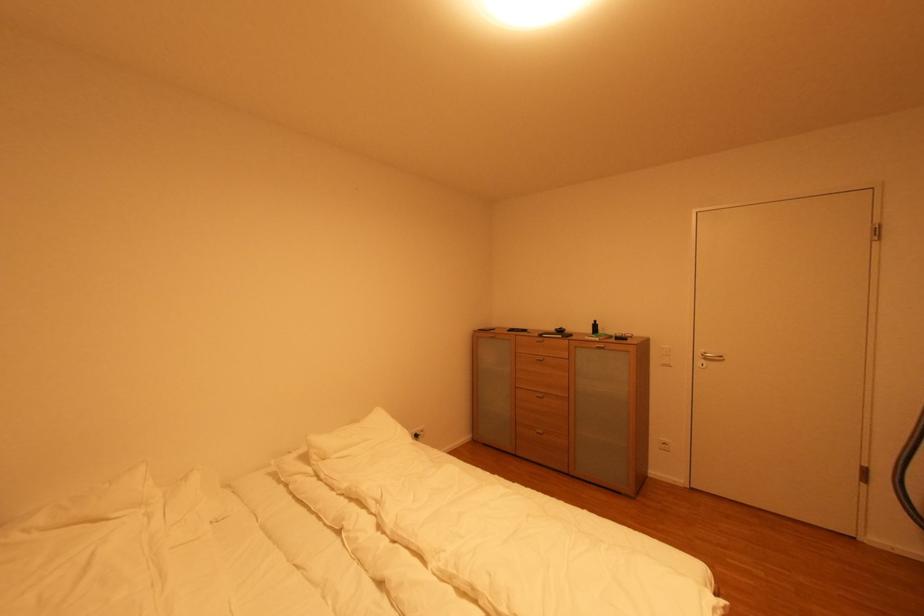
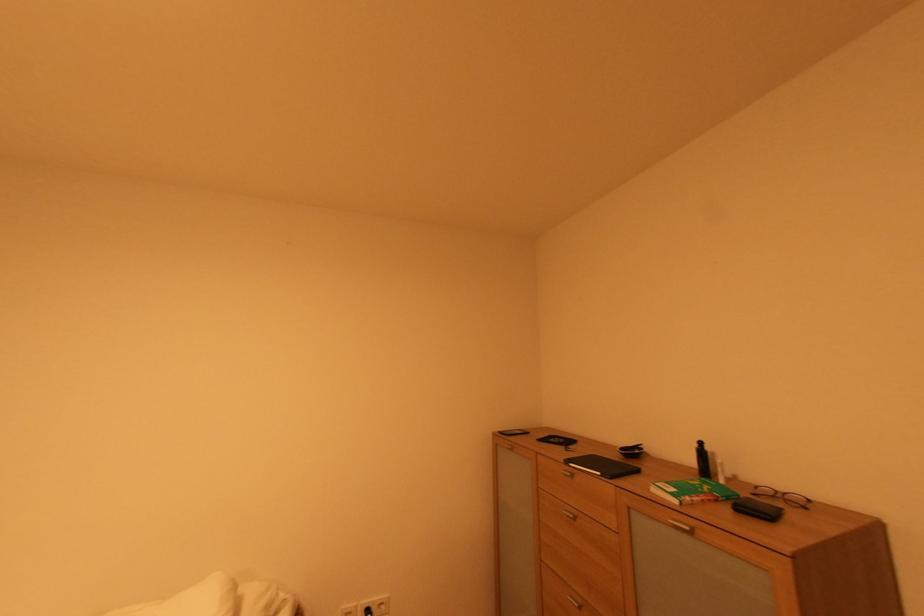
In the second image, find the point that corresponds to (x=599, y=323) in the first image.

(701, 447)